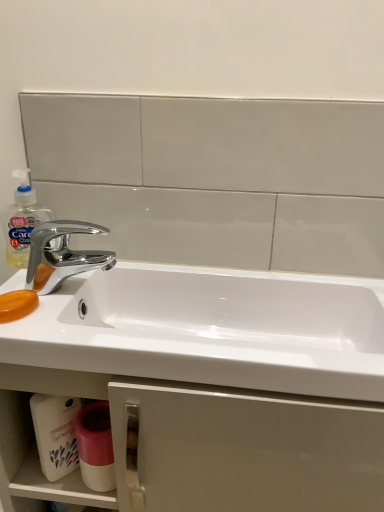
What is the approximate height of white glossy cup at lower center?

white glossy cup at lower center is 5.15 inches in height.

Locate an element on the screen. Image resolution: width=384 pixels, height=512 pixels. white glossy cup at lower center is located at coordinates (96, 446).

Where is `chrome/metallic faucet at left`? The width and height of the screenshot is (384, 512). chrome/metallic faucet at left is located at coordinates (62, 254).

What are the coordinates of `white plastic container at lower left` in the screenshot? It's located at (34, 464).

Which is in front, point (27, 268) or point (93, 484)?

The point (93, 484) is in front.

Between chrome/metallic faucet at left and white glossy cup at lower center, which one has less height?

chrome/metallic faucet at left is shorter.

Looking at this image, which is in front, chrome/metallic faucet at left or white glossy cup at lower center?

chrome/metallic faucet at left is closer to the camera.

Is chrome/metallic faucet at left positioned far away from white glossy cup at lower center?

No, chrome/metallic faucet at left is not far from white glossy cup at lower center.

Can you confirm if translucent plastic soap dispenser at left is taller than white plastic container at lower left?

No, translucent plastic soap dispenser at left is not taller than white plastic container at lower left.

Does point (15, 252) come farther from viewer compared to point (25, 402)?

Yes, point (15, 252) is behind point (25, 402).

Which object is wider, translucent plastic soap dispenser at left or white plastic container at lower left?

white plastic container at lower left.

From the image's perspective, is translucent plastic soap dispenser at left below white plastic container at lower left?

No, from the image's perspective, translucent plastic soap dispenser at left is not beneath white plastic container at lower left.

Is orange translucent soap at left surrounded by translucent plastic soap dispenser at left?

No, orange translucent soap at left is not a part of translucent plastic soap dispenser at left.

How many degrees apart are the facing directions of translucent plastic soap dispenser at left and orange translucent soap at left?

The facing directions of translucent plastic soap dispenser at left and orange translucent soap at left are 0.215 degrees apart.

Which point is more forward, (x=13, y=223) or (x=5, y=322)?

The point (x=5, y=322) is closer to the camera.

Considering the sizes of objects translucent plastic soap dispenser at left and orange translucent soap at left in the image provided, who is bigger, translucent plastic soap dispenser at left or orange translucent soap at left?

translucent plastic soap dispenser at left is bigger.

Does white plastic container at lower left have a larger size compared to white matte cabinet at lower center?

No.

From a real-world perspective, who is located lower, white plastic container at lower left or white matte cabinet at lower center?

white matte cabinet at lower center is physically lower.

From the image's perspective, between white plastic container at lower left and white matte cabinet at lower center, which one is located above?

white plastic container at lower left appears higher in the image.

Measure the distance from white plastic container at lower left to white matte cabinet at lower center.

They are 4.88 inches apart.

Considering the sizes of orange translucent soap at left and white glossy cup at lower center in the image, is orange translucent soap at left wider or thinner than white glossy cup at lower center?

Clearly, orange translucent soap at left has more width compared to white glossy cup at lower center.

Looking at this image, can you confirm if orange translucent soap at left is bigger than white glossy cup at lower center?

Incorrect, orange translucent soap at left is not larger than white glossy cup at lower center.

From the image's perspective, is orange translucent soap at left on white glossy cup at lower center?

Yes.

Do you think orange translucent soap at left is within white glossy cup at lower center, or outside of it?

orange translucent soap at left is outside white glossy cup at lower center.

Can you confirm if translucent plastic soap dispenser at left is taller than white glossy sink at center?

Indeed, translucent plastic soap dispenser at left has a greater height compared to white glossy sink at center.

Identify the location of cleaning product that appears behind the white glossy sink at center. (21, 220).

Looking at this image, is translucent plastic soap dispenser at left positioned in front of white glossy sink at center?

No.

Is translucent plastic soap dispenser at left wider than white glossy sink at center?

No.

Which is nearer, (280, 397) or (96, 417)?

The point (280, 397) is closer to the camera.

Based on the photo, is white matte cabinet at lower center aimed at white glossy cup at lower center?

Yes.

From their relative heights in the image, would you say white matte cabinet at lower center is taller or shorter than white glossy cup at lower center?

In the image, white matte cabinet at lower center appears to be taller than white glossy cup at lower center.

Considering the positions of objects white matte cabinet at lower center and white glossy cup at lower center in the image provided, who is behind, white matte cabinet at lower center or white glossy cup at lower center?

white glossy cup at lower center.

Identify the location of tap above the white glossy cup at lower center (from a real-world perspective). The width and height of the screenshot is (384, 512). (62, 254).

Where is `cleaning product lying on the left of white plastic container at lower left`? Image resolution: width=384 pixels, height=512 pixels. cleaning product lying on the left of white plastic container at lower left is located at coordinates (21, 220).

Based on their spatial positions, is orange translucent soap at left or white plastic container at lower left further from white glossy sink at center?

Among the two, white plastic container at lower left is located further to white glossy sink at center.

Based on their spatial positions, is white matte cabinet at lower center or white glossy sink at center closer to translucent plastic soap dispenser at left?

white glossy sink at center lies closer to translucent plastic soap dispenser at left than the other object.

Which object lies nearer to the anchor point white glossy cup at lower center, orange translucent soap at left or white plastic container at lower left?

white plastic container at lower left is closer to white glossy cup at lower center.

Considering their positions, is orange translucent soap at left positioned further to translucent plastic soap dispenser at left than white glossy cup at lower center?

The object further to translucent plastic soap dispenser at left is white glossy cup at lower center.

Estimate the real-world distances between objects in this image. Which object is closer to translucent plastic soap dispenser at left, white glossy sink at center or orange translucent soap at left?

orange translucent soap at left is closer to translucent plastic soap dispenser at left.

Based on the photo, considering their positions, is white plastic container at lower left positioned closer to white matte cabinet at lower center than white glossy cup at lower center?

white plastic container at lower left is closer to white matte cabinet at lower center.

Which object lies nearer to the anchor point white glossy sink at center, white glossy cup at lower center or chrome/metallic faucet at left?

chrome/metallic faucet at left lies closer to white glossy sink at center than the other object.

Estimate the real-world distances between objects in this image. Which object is further from white matte cabinet at lower center, white glossy sink at center or white plastic container at lower left?

white glossy sink at center lies further to white matte cabinet at lower center than the other object.

Identify the location of shelf between chrome/metallic faucet at left and white matte cabinet at lower center vertically. The image size is (384, 512). (34, 464).

The width and height of the screenshot is (384, 512). Find the location of `toiletry between orange translucent soap at left and white matte cabinet at lower center from top to bottom`. toiletry between orange translucent soap at left and white matte cabinet at lower center from top to bottom is located at coordinates (96, 446).

This screenshot has height=512, width=384. Identify the location of sink between chrome/metallic faucet at left and white glossy cup at lower center in the up-down direction. (210, 330).

The width and height of the screenshot is (384, 512). Find the location of `tap between translucent plastic soap dispenser at left and white glossy sink at center in the horizontal direction`. tap between translucent plastic soap dispenser at left and white glossy sink at center in the horizontal direction is located at coordinates click(x=62, y=254).